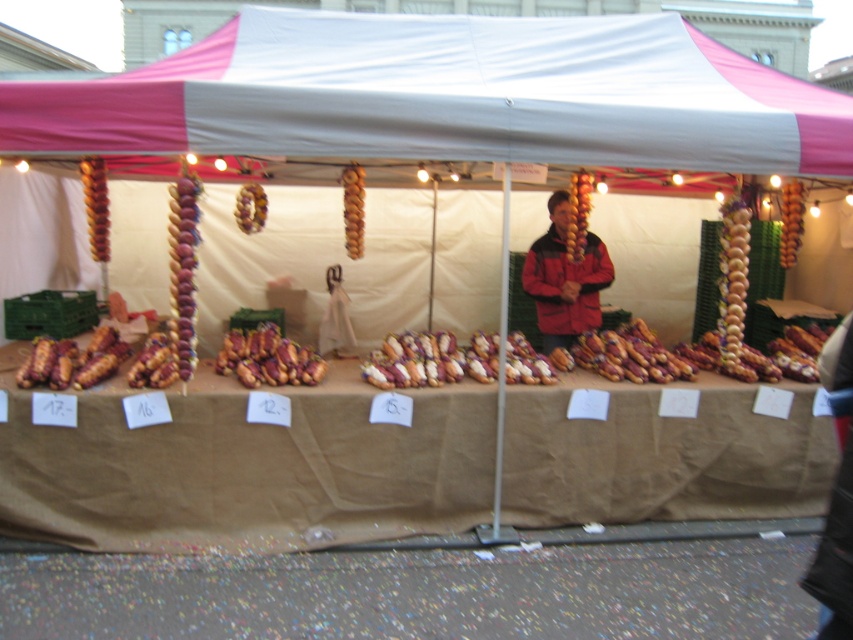
Question: Is golden-brown bread rolls at center to the right of brown glossy skewers at left from the viewer's perspective?

Choices:
 (A) yes
 (B) no

Answer: (A)

Question: Which object is closer to the camera taking this photo?

Choices:
 (A) pink fabric canopy at upper center
 (B) golden-brown bread rolls at center
 (C) yellowish-brown textured skewers at center

Answer: (A)

Question: Which object is positioned closest to the brown textured bread at center?

Choices:
 (A) brown matte hot dog at center
 (B) shiny metallic hot dog at center
 (C) brown paper table at center
 (D) pink fabric canopy at upper center

Answer: (B)

Question: Does shiny metallic hot dog at center appear under brown glossy skewers at center?

Choices:
 (A) yes
 (B) no

Answer: (A)

Question: Considering the relative positions of golden-brown bread rolls at center and brown textured bread at center in the image provided, where is golden-brown bread rolls at center located with respect to brown textured bread at center?

Choices:
 (A) above
 (B) below

Answer: (B)

Question: Which point is farther from the camera taking this photo?

Choices:
 (A) (450, 349)
 (B) (666, 116)
 (C) (782, 260)

Answer: (C)